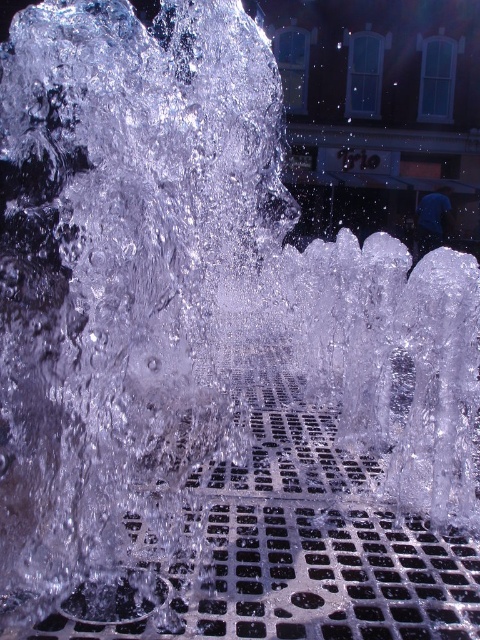
You are standing in front of the fountain and notice two metallic grids. The first one is labeled as the metallic grid at center, and the second is the metallic grid at lower center. Which of these two grids is positioned higher up in the scene?

The metallic grid at center is positioned higher up than the metallic grid at lower center according to the description.

You are standing in front of a fountain and see the metallic grid at center and the metallic grid at lower center. Which one is closer to you?

The metallic grid at center is closer to you because it is in front of the metallic grid at lower center.